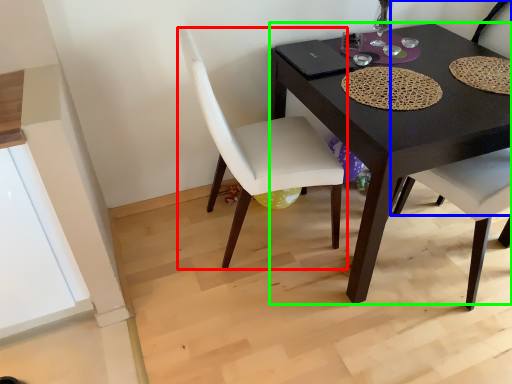
Question: Estimate the real-world distances between objects in this image. Which object is farther from chair (highlighted by a red box), chair (highlighted by a blue box) or desk (highlighted by a green box)?

Choices:
 (A) chair
 (B) desk

Answer: (A)